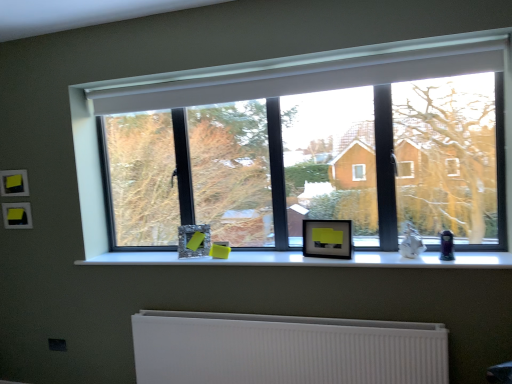
The image size is (512, 384). In order to click on vacant space situated above white ribbed radiator at lower center (from a real-world perspective) in this screenshot , I will do `click(231, 315)`.